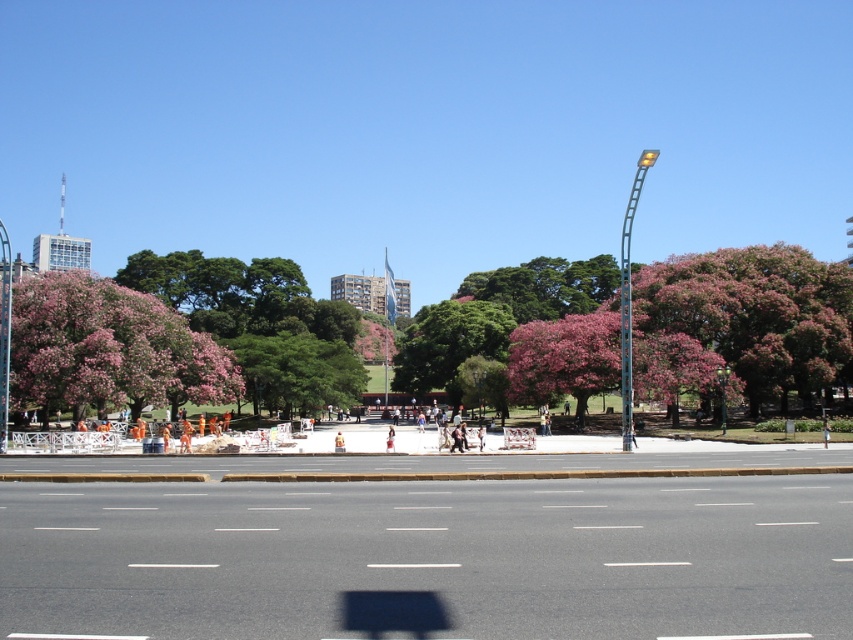
Question: Is pink matte tree at upper right positioned behind pink textured tree at center?

Choices:
 (A) yes
 (B) no

Answer: (B)

Question: Estimate the real-world distances between objects in this image. Which object is closer to the pink bloom tree at left?

Choices:
 (A) green leafy tree at center
 (B) pink matte tree at upper right

Answer: (B)

Question: Which point is closer to the camera taking this photo?

Choices:
 (A) (746, 304)
 (B) (444, 317)
 (C) (310, 397)

Answer: (A)

Question: Among these objects, which one is farthest from the camera?

Choices:
 (A) pink bloom tree at left
 (B) green leafy tree at center

Answer: (B)

Question: Where is pink bloom tree at left located in relation to pink textured tree at center in the image?

Choices:
 (A) right
 (B) left

Answer: (B)

Question: Does pink bloom tree at left appear under pink textured tree at center?

Choices:
 (A) yes
 (B) no

Answer: (B)